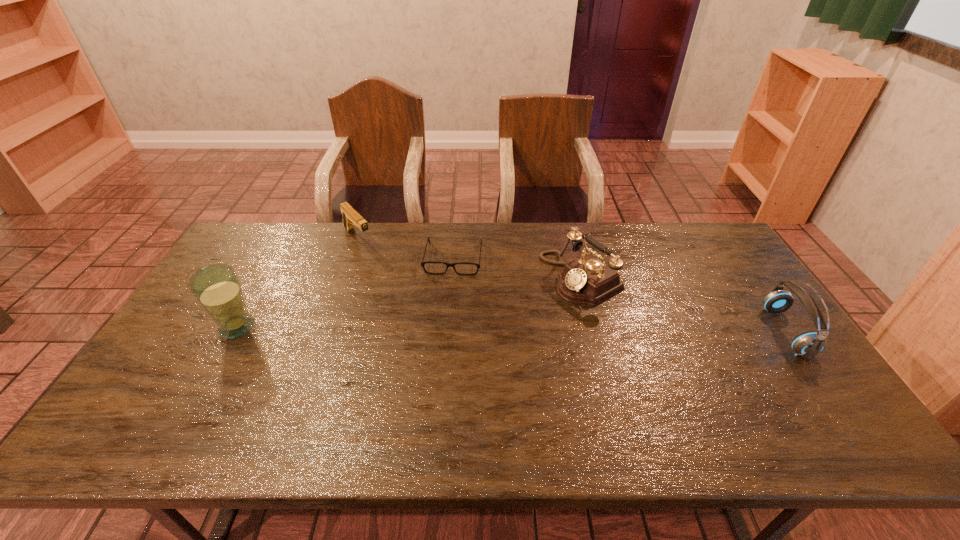
Where is `glass`? Image resolution: width=960 pixels, height=540 pixels. glass is located at coordinates (217, 288).

Identify the location of headset. tap(807, 345).

This screenshot has height=540, width=960. What are the coordinates of `the shortest object` in the screenshot? It's located at (422, 263).

You are a GUI agent. You are given a task and a screenshot of the screen. Output one action in this format:
    pyautogui.click(x=<x>, y=<y>)
    Task: Click on the spectacles
    
    Given the screenshot: What is the action you would take?
    pyautogui.click(x=422, y=263)

Image resolution: width=960 pixels, height=540 pixels. Identify the location of the fourth object from right to left. (x=350, y=217).

Identify the location of the second shortest object. Image resolution: width=960 pixels, height=540 pixels. (350, 217).

Locate an element on the screen. the second object from right to left is located at coordinates (587, 280).

Where is `free space located on the right of the glass`? This screenshot has width=960, height=540. free space located on the right of the glass is located at coordinates (348, 327).

This screenshot has height=540, width=960. Find the location of `free region located 0.120m on the front-facing side of the shortest object`. free region located 0.120m on the front-facing side of the shortest object is located at coordinates (446, 302).

This screenshot has width=960, height=540. Find the location of `free space located 0.290m on the front-facing side of the shortest object`. free space located 0.290m on the front-facing side of the shortest object is located at coordinates (441, 346).